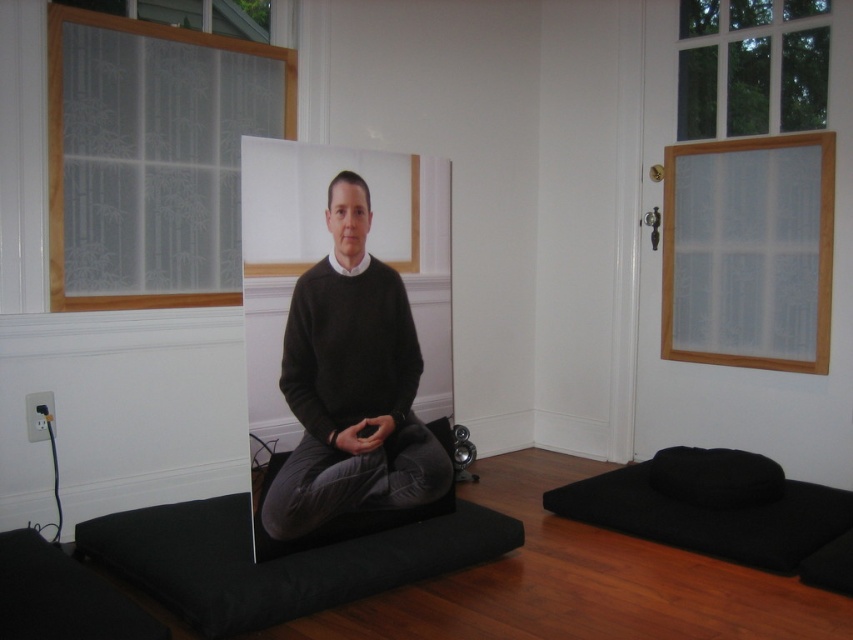
Does black fabric mat at center have a greater width compared to black fabric pillow at lower right?

Correct, the width of black fabric mat at center exceeds that of black fabric pillow at lower right.

Does black fabric mat at center appear on the right side of black fabric pillow at lower right?

Incorrect, black fabric mat at center is not on the right side of black fabric pillow at lower right.

The width and height of the screenshot is (853, 640). I want to click on black fabric mat at center, so click(277, 560).

Locate an element on the screen. The height and width of the screenshot is (640, 853). black fabric mat at center is located at coordinates (277, 560).

The image size is (853, 640). What do you see at coordinates (709, 518) in the screenshot?
I see `black matte mat at lower right` at bounding box center [709, 518].

Does point (683, 508) lie behind point (750, 476)?

That is False.

Where is `black matte mat at lower right`? black matte mat at lower right is located at coordinates click(709, 518).

Can you confirm if matte black sweater at center is bigger than black fabric pillow at lower right?

Indeed, matte black sweater at center has a larger size compared to black fabric pillow at lower right.

Between matte black sweater at center and black fabric pillow at lower right, which one appears on the right side from the viewer's perspective?

Positioned to the right is black fabric pillow at lower right.

What do you see at coordinates (347, 348) in the screenshot? This screenshot has width=853, height=640. I see `matte black sweater at center` at bounding box center [347, 348].

At what (x,y) coordinates should I click in order to perform the action: click on matte black sweater at center. Please return your answer as a coordinate pair (x, y). This screenshot has height=640, width=853. Looking at the image, I should click on (347, 348).